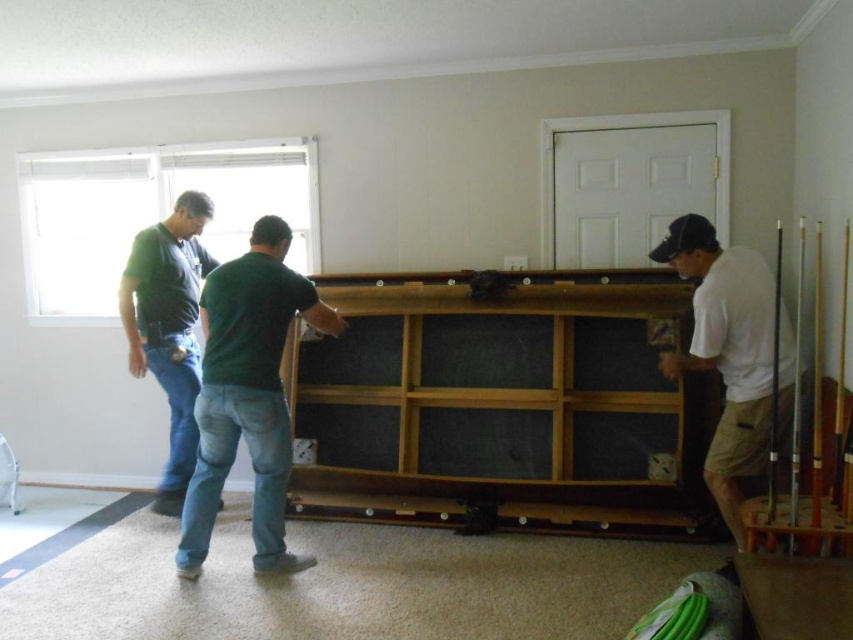
Question: Considering the relative positions of green matte shirt at center and matte black shirt at left in the image provided, where is green matte shirt at center located with respect to matte black shirt at left?

Choices:
 (A) right
 (B) left

Answer: (A)

Question: Is green matte shirt at center wider than white cotton shirt at right?

Choices:
 (A) no
 (B) yes

Answer: (B)

Question: Estimate the real-world distances between objects in this image. Which object is farther from the white cotton shirt at right?

Choices:
 (A) matte black shirt at left
 (B) green matte shirt at center

Answer: (A)

Question: Does white cotton shirt at right appear under matte black shirt at left?

Choices:
 (A) yes
 (B) no

Answer: (A)

Question: Which object is farther from the camera taking this photo?

Choices:
 (A) matte black shirt at left
 (B) white cotton shirt at right
 (C) green matte shirt at center

Answer: (A)

Question: Estimate the real-world distances between objects in this image. Which object is farther from the green matte shirt at center?

Choices:
 (A) white cotton shirt at right
 (B) matte black shirt at left

Answer: (A)